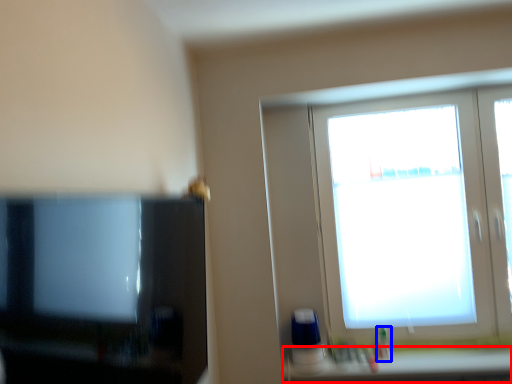
Question: Which object appears farthest to the camera in this image, window sill (highlighted by a red box) or toiletry (highlighted by a blue box)?

Choices:
 (A) window sill
 (B) toiletry

Answer: (B)